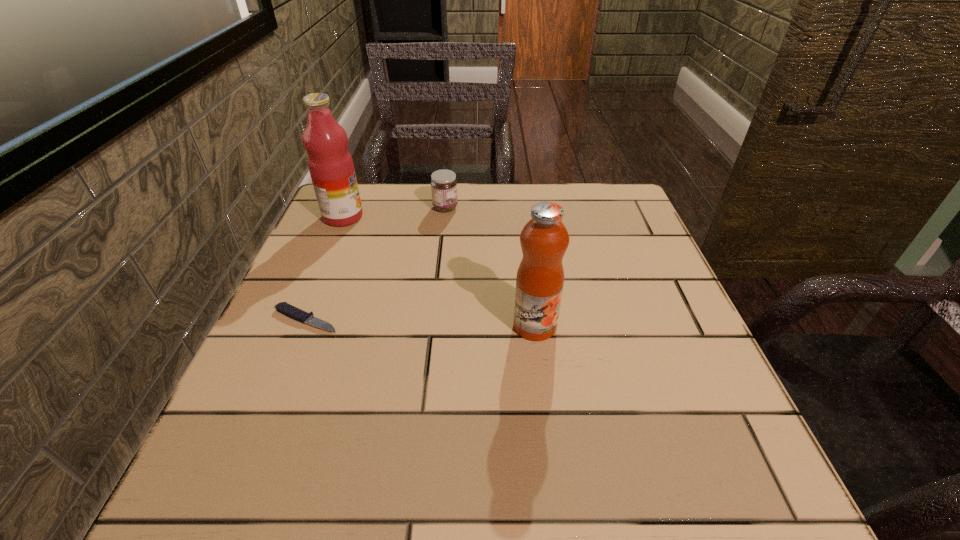
Locate an element on the screen. This screenshot has width=960, height=540. vacant area that lies between the steak knife and the farther fruit juice is located at coordinates (324, 268).

Identify the location of vacant region between the farther fruit juice and the nearer fruit juice. point(439,271).

Identify which object is located as the nearest to the right fruit juice. Please provide its 2D coordinates. Your answer should be formatted as a tuple, i.e. [(x, y)], where the tuple contains the x and y coordinates of a point satisfying the conditions above.

[(284, 308)]

Locate an element on the screen. object that stands as the closest to the second shortest object is located at coordinates (331, 167).